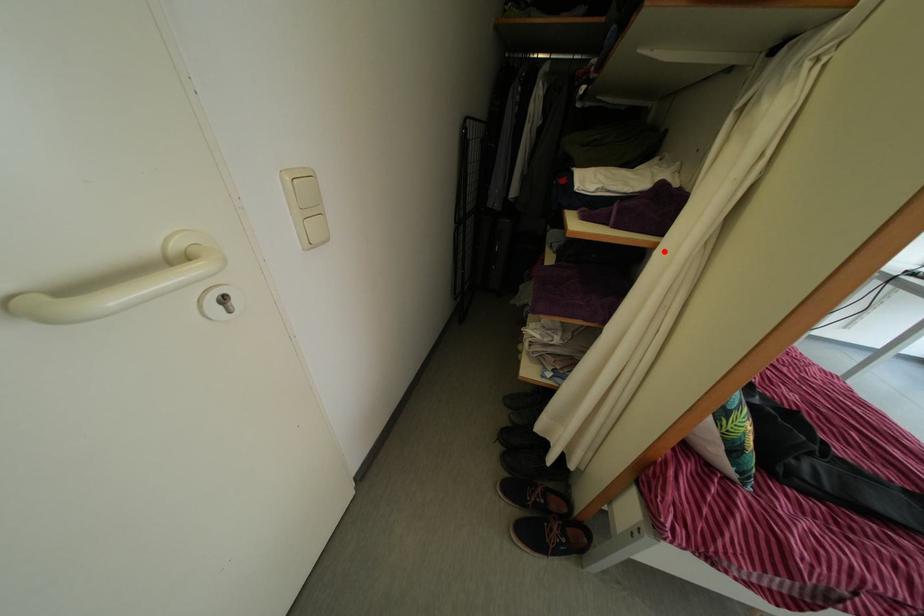
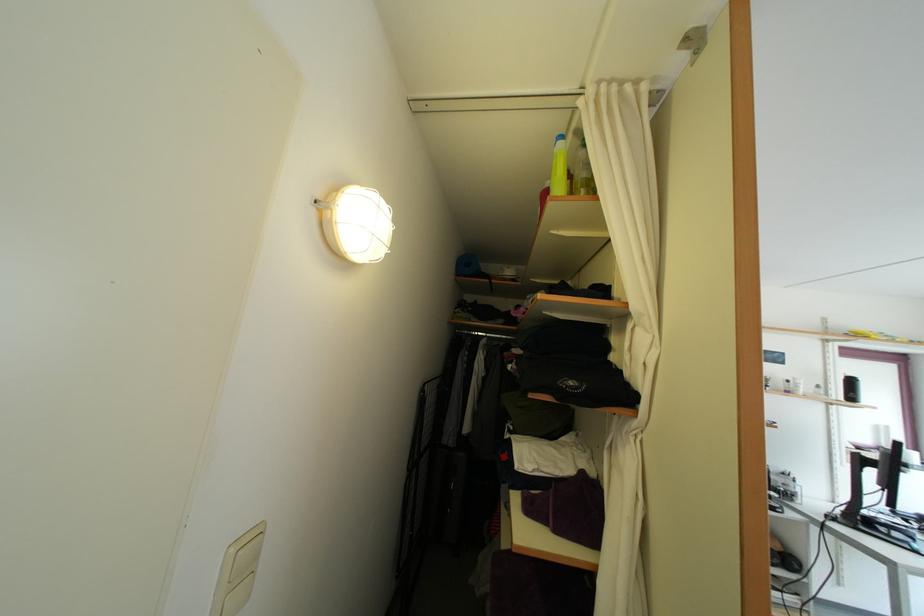
In the second image, find the point that corresponds to the highlighted location in the first image.

(602, 576)